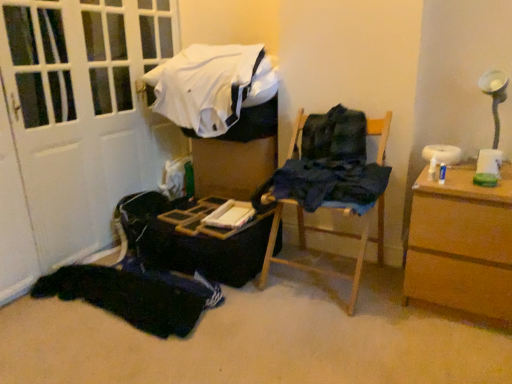
Locate an element on the screen. free space between brown wooden chest of drawers at right and wooden chair at center is located at coordinates (390, 297).